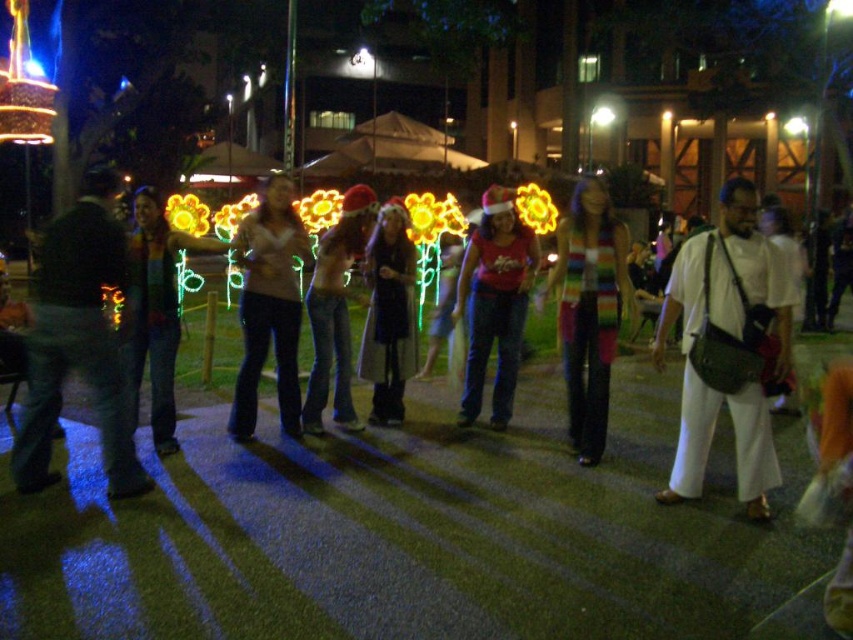
Question: Is dark blue jeans at left above rainbow striped scarf at center?

Choices:
 (A) yes
 (B) no

Answer: (B)

Question: Which object appears farthest from the camera in this image?

Choices:
 (A) rainbow striped scarf at center
 (B) matte red shirt at center

Answer: (B)

Question: Can you confirm if rainbow striped scarf at center is positioned above matte beige sweater at center?

Choices:
 (A) yes
 (B) no

Answer: (B)

Question: Does matte beige sweater at center lie in front of matte red shirt at center?

Choices:
 (A) yes
 (B) no

Answer: (A)

Question: Considering the real-world distances, which object is closest to the jeans at center?

Choices:
 (A) gray fabric coat at center
 (B) rainbow striped scarf at center
 (C) dark blue jeans at left
 (D) rainbow striped sweater at center

Answer: (A)

Question: Among these points, which one is farthest from the camera?

Choices:
 (A) tap(451, 324)
 (B) tap(241, 365)
 (C) tap(137, 298)

Answer: (A)